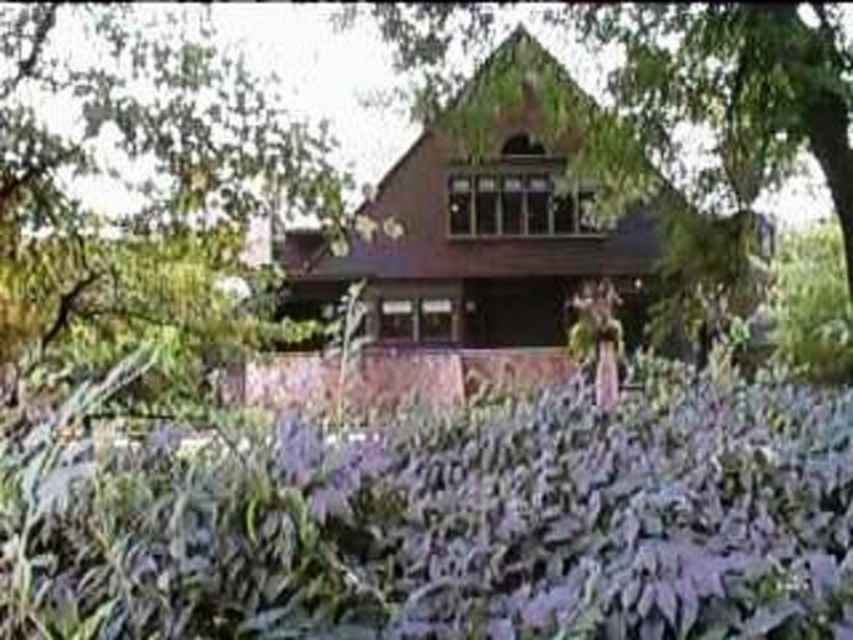
Question: Does green leafy tree at upper center have a lesser width compared to green leafy tree at center?

Choices:
 (A) no
 (B) yes

Answer: (B)

Question: Does green leafy tree at upper center come behind green leafy tree at center?

Choices:
 (A) yes
 (B) no

Answer: (A)

Question: From the image, what is the correct spatial relationship of green leafy tree at upper center in relation to green leafy tree at center?

Choices:
 (A) right
 (B) left

Answer: (B)

Question: Which point is closer to the camera?

Choices:
 (A) (740, 49)
 (B) (332, 240)

Answer: (A)